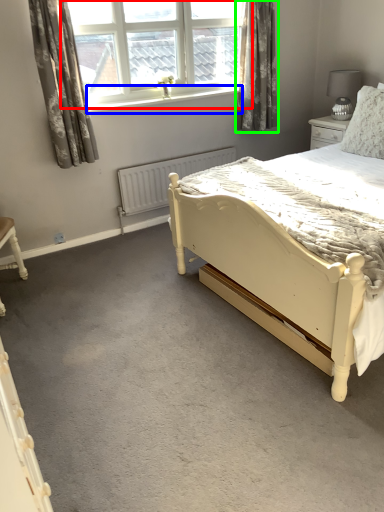
Question: Which object is positioned closest to window (highlighted by a red box)? Select from window sill (highlighted by a blue box) and curtain (highlighted by a green box).

Choices:
 (A) window sill
 (B) curtain

Answer: (A)